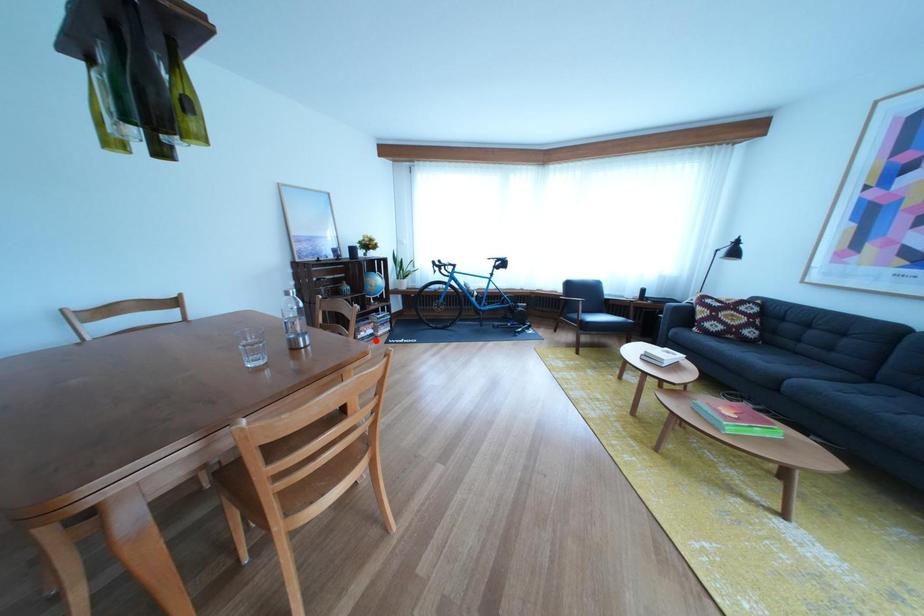
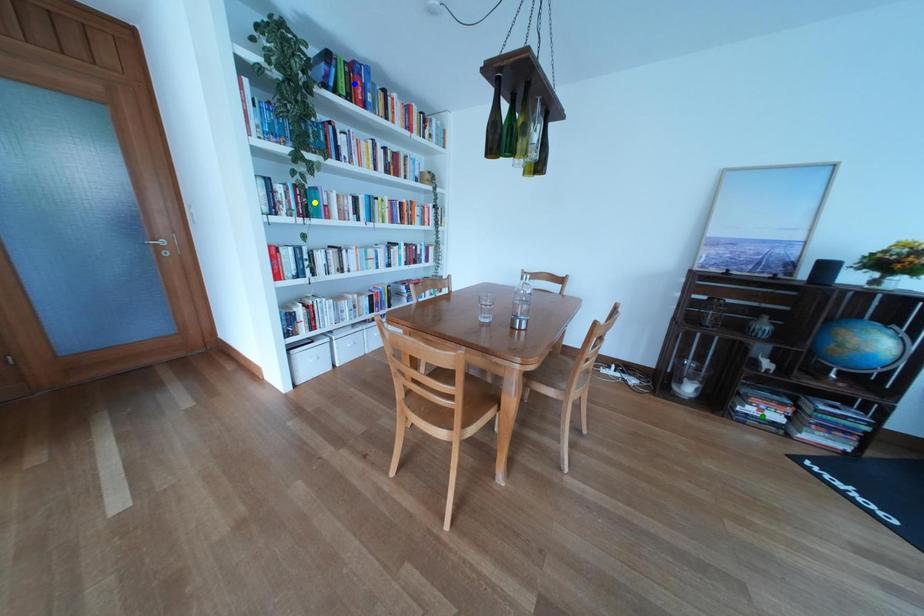
Question: I am providing you with two images of the same scene from different viewpoints. A red point is marked on the first image. You are given multiple points on the second image. Which point in image 2 is actually the same real-world point as the red point in image 1?

Choices:
 (A) yellow point
 (B) blue point
 (C) green point

Answer: (C)